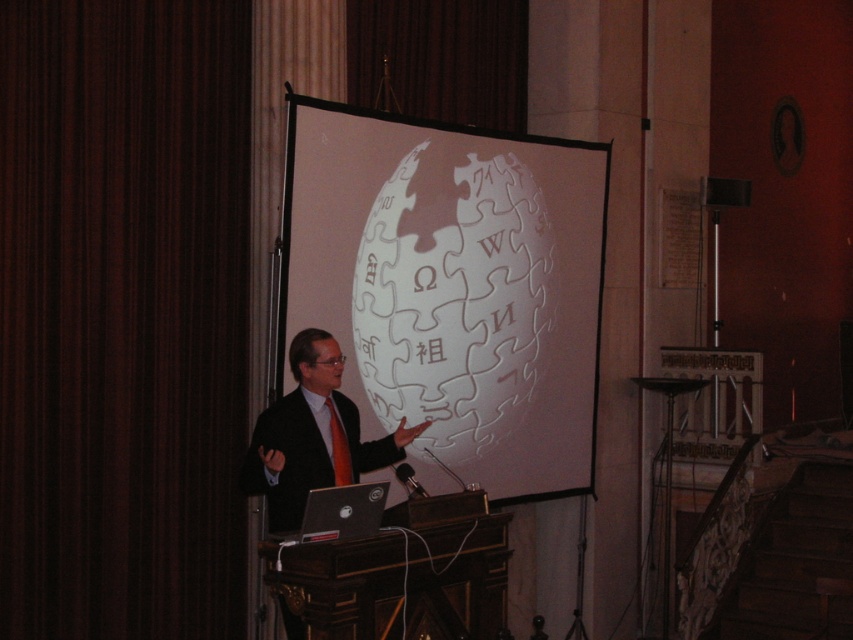
From the picture: Is dark brown fabric at left smaller than matte black suit at center?

No.

Locate an element on the screen. This screenshot has width=853, height=640. dark brown fabric at left is located at coordinates (122, 316).

Identify the location of dark brown fabric at left. Image resolution: width=853 pixels, height=640 pixels. (122, 316).

The image size is (853, 640). I want to click on dark brown fabric at left, so click(x=122, y=316).

The width and height of the screenshot is (853, 640). Identify the location of dark brown fabric at left. (122, 316).

This screenshot has height=640, width=853. I want to click on dark brown fabric at left, so click(x=122, y=316).

Between point (387, 236) and point (308, 381), which one is positioned behind?

Positioned behind is point (387, 236).

You are a GUI agent. You are given a task and a screenshot of the screen. Output one action in this format:
    pyautogui.click(x=<x>, y=<y>)
    Task: Click on the white matte projection screen at center
    This screenshot has height=640, width=853.
    Given the screenshot: What is the action you would take?
    pyautogui.click(x=451, y=288)

Locate an element on the screen. This screenshot has width=853, height=640. white matte projection screen at center is located at coordinates (451, 288).